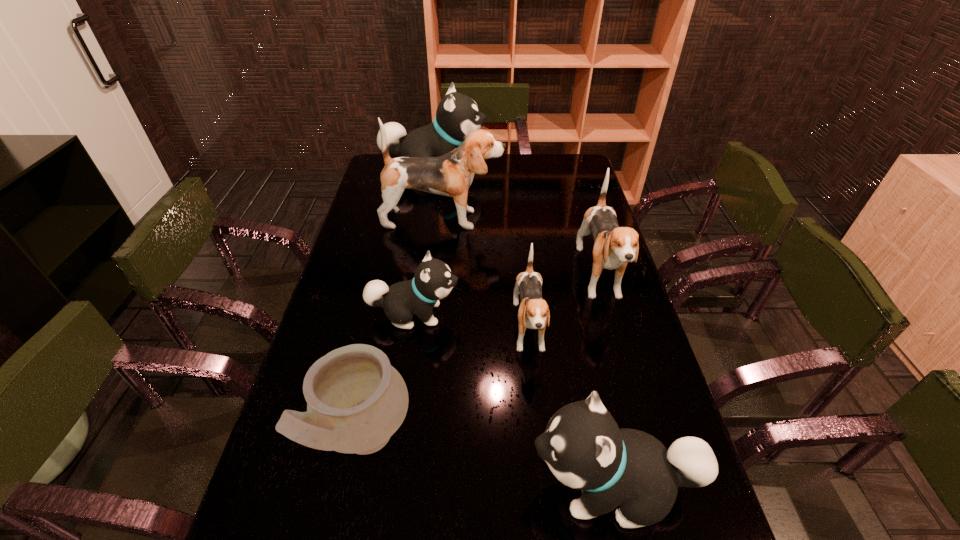
Where is `vacant position in the image that satisfies the following two spatial constraints: 1. at the face of the fifth nearest puppy; 2. on the front side of the brown pottery`? vacant position in the image that satisfies the following two spatial constraints: 1. at the face of the fifth nearest puppy; 2. on the front side of the brown pottery is located at coordinates (420, 439).

Locate an element on the screen. This screenshot has height=540, width=960. free location that satisfies the following two spatial constraints: 1. at the face of the rightmost brown puppy; 2. at the face of the second biggest white puppy is located at coordinates (660, 487).